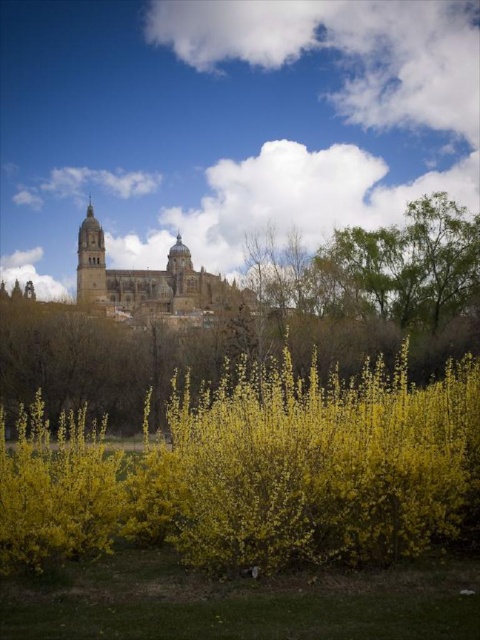
Who is more distant from viewer, (x=231, y=515) or (x=85, y=276)?

Point (x=85, y=276)

The width and height of the screenshot is (480, 640). In order to click on yellow matte flower at lower center in this screenshot , I will do `click(255, 472)`.

This screenshot has width=480, height=640. Find the location of `yellow matte flower at lower center`. yellow matte flower at lower center is located at coordinates (255, 472).

In order to click on brown stone tower at center in this screenshot , I will do `click(144, 280)`.

Does point (183, 275) come closer to viewer compared to point (101, 296)?

That is False.

Which is in front, point (207, 300) or point (76, 284)?

Positioned in front is point (76, 284).

Locate an element on the screen. brown stone tower at center is located at coordinates (144, 280).

Does yellow matte flower at lower center appear on the left side of smooth stone tower at upper left?

In fact, yellow matte flower at lower center is to the right of smooth stone tower at upper left.

Is point (400, 545) closer to camera compared to point (87, 237)?

Yes, point (400, 545) is closer to viewer.

Identify the location of yellow matte flower at lower center. Image resolution: width=480 pixels, height=640 pixels. (255, 472).